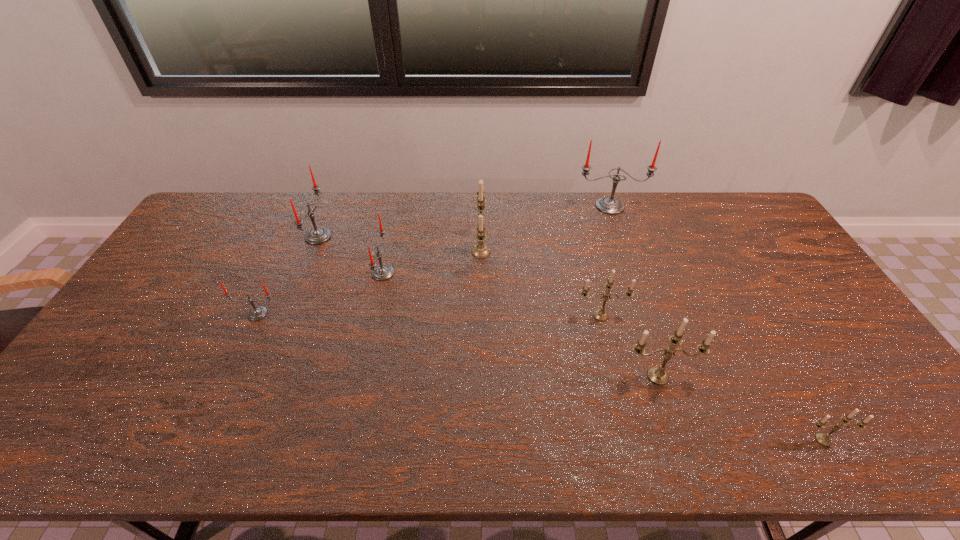
Where is `free spot located on the left of the nearest candle`? free spot located on the left of the nearest candle is located at coordinates 689,440.

Find the location of a particular element. The width and height of the screenshot is (960, 540). object at the near edge is located at coordinates (824, 439).

Locate an element on the screen. Image resolution: width=960 pixels, height=540 pixels. vacant position at the far edge of the desktop is located at coordinates (697, 206).

Image resolution: width=960 pixels, height=540 pixels. Identify the location of free space at the near edge of the desktop. (852, 443).

At what (x,y) coordinates should I click in order to perform the action: click on vacant point at the left edge. Please return your answer as a coordinate pair (x, y). The width and height of the screenshot is (960, 540). Looking at the image, I should click on (165, 286).

In order to click on free space at the right edge in this screenshot , I will do `click(820, 340)`.

Where is `blank area at the far left corner`? The height and width of the screenshot is (540, 960). blank area at the far left corner is located at coordinates (231, 215).

This screenshot has height=540, width=960. In the image, there is a desktop. Identify the location of vacant region at the far right corner. (x=756, y=225).

Image resolution: width=960 pixels, height=540 pixels. What are the coordinates of `free point between the leftmost metallic candle and the third smallest red candle` in the screenshot? It's located at (x=399, y=244).

Where is `free area in between the rightmost object and the third object from left to right`? Image resolution: width=960 pixels, height=540 pixels. free area in between the rightmost object and the third object from left to right is located at coordinates (603, 356).